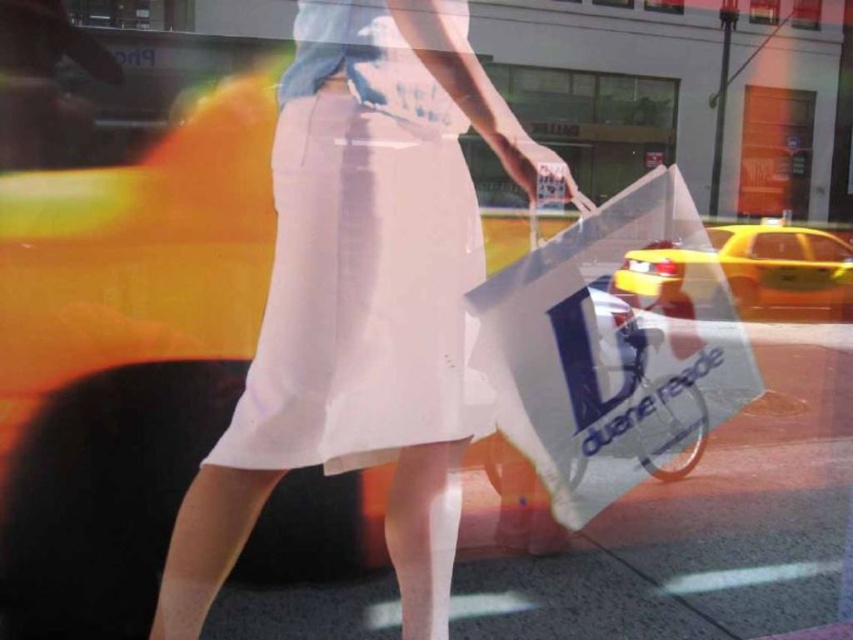
You are a photographer trying to capture the transparent plastic bag at center in your shot. Since the white smooth pavement at center is in the way, can you adjust your camera angle to focus on the bag without the pavement blocking it?

The white smooth pavement at center is closer to the viewer than the transparent plastic bag at center. To focus on the bag without the pavement blocking it, you would need to adjust your angle so that the pavement is no longer between the camera and the bag. This might involve moving to the side or changing your viewpoint to capture the bag while avoiding the pavement obstruction.

You are a fashion designer observing the image. You need to decide which item, the matte white skirt at center or the transparent plastic bag at center, has a larger width to incorporate into a new design. Based on the scene description, which one should you choose?

The matte white skirt at center might be wider than transparent plastic bag at center, so you should choose the matte white skirt at center for its larger width in the new design.